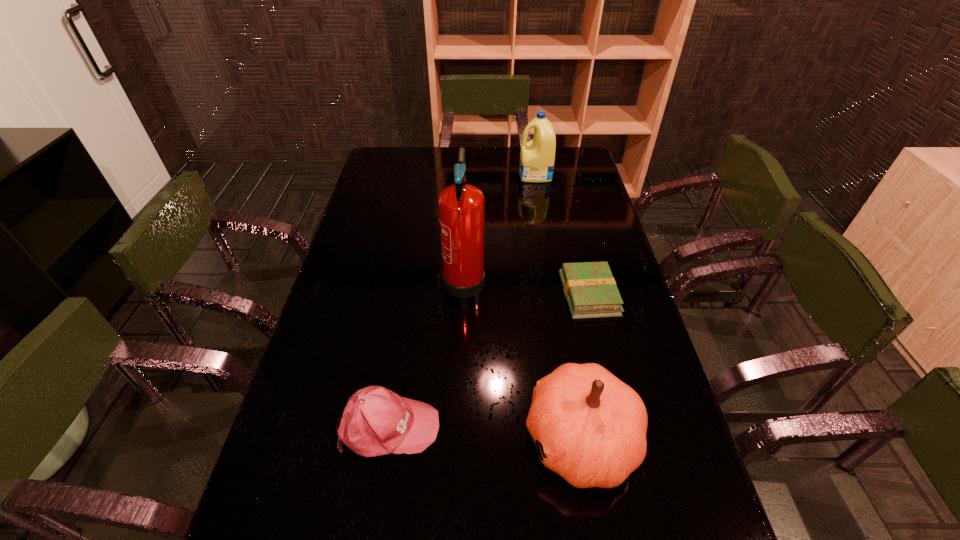
The image size is (960, 540). Find the location of `free space located 0.150m on the front-facing side of the pumpkin`. free space located 0.150m on the front-facing side of the pumpkin is located at coordinates (458, 439).

Where is `free space located 0.130m on the front-facing side of the pumpkin`? This screenshot has width=960, height=540. free space located 0.130m on the front-facing side of the pumpkin is located at coordinates point(467,439).

The width and height of the screenshot is (960, 540). I want to click on blank area located 0.310m at the front of the fourth tallest object with the brim, so click(x=573, y=426).

Where is `vacant position located 0.270m on the front of the book`? vacant position located 0.270m on the front of the book is located at coordinates (615, 404).

The width and height of the screenshot is (960, 540). What are the coordinates of `object positioned at the far edge` in the screenshot? It's located at (537, 156).

The image size is (960, 540). I want to click on object at the left edge, so click(376, 421).

Locate an element on the screen. pumpkin located at the right edge is located at coordinates (592, 427).

Where is `book positioned at the right edge`? The height and width of the screenshot is (540, 960). book positioned at the right edge is located at coordinates (590, 290).

In the image, there is a desktop. Where is `vacant space at the far edge`? Image resolution: width=960 pixels, height=540 pixels. vacant space at the far edge is located at coordinates (480, 152).

Where is `free location at the left edge`? Image resolution: width=960 pixels, height=540 pixels. free location at the left edge is located at coordinates (353, 261).